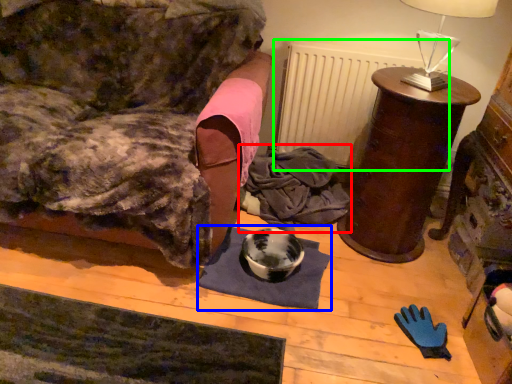
Question: Considering the real-world distances, which object is farthest from clothing (highlighted by a red box)? mat (highlighted by a blue box) or radiator (highlighted by a green box)?

Choices:
 (A) mat
 (B) radiator

Answer: (A)